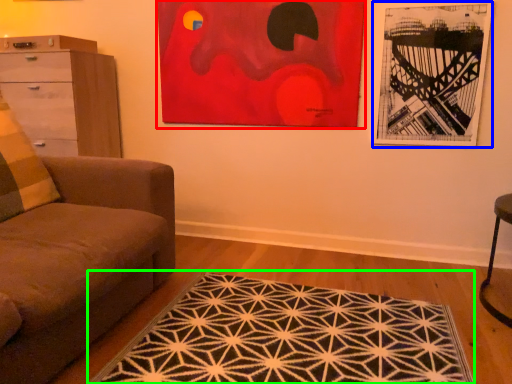
Question: Based on their relative distances, which object is farther from picture frame (highlighted by a red box)? Choose from picture frame (highlighted by a blue box) and mat (highlighted by a green box).

Choices:
 (A) picture frame
 (B) mat

Answer: (B)